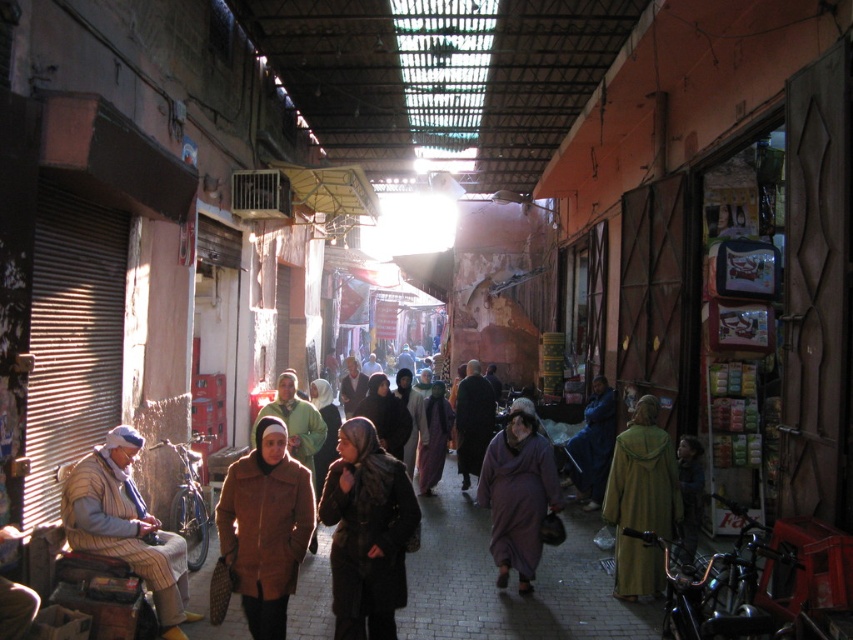
Question: Which object is positioned closest to the green woolen robe at right?

Choices:
 (A) purple fabric dress at center
 (B) dark brown fur coat at center

Answer: (A)

Question: From the image, what is the correct spatial relationship of dark blue fabric at center in relation to dark purple fabric at center?

Choices:
 (A) right
 (B) left

Answer: (A)

Question: Which object appears farthest from the camera in this image?

Choices:
 (A) dark brown fur coat at center
 (B) striped woolen vest at lower left
 (C) purple fabric dress at center
 (D) green woolen robe at right

Answer: (C)

Question: Among these objects, which one is farthest from the camera?

Choices:
 (A) green woolen robe at right
 (B) dark brown fur coat at center

Answer: (A)

Question: Is green woolen robe at right to the left of purple fabric dress at center from the viewer's perspective?

Choices:
 (A) yes
 (B) no

Answer: (B)

Question: Is brown leather coat at center closer to the viewer compared to dark brown coat at center?

Choices:
 (A) yes
 (B) no

Answer: (A)